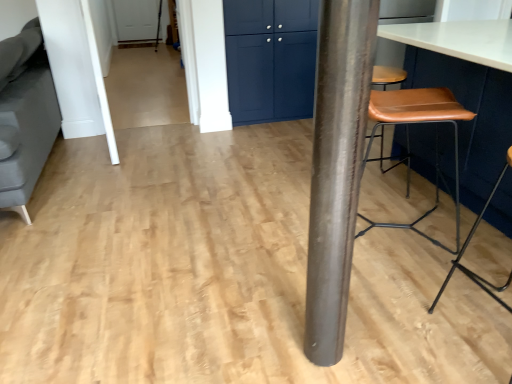
Locate an element on the screen. free space between brown leather stool at right and brown leather stool at right is located at coordinates (433, 274).